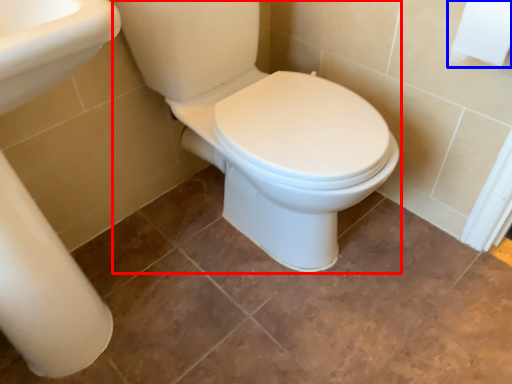
Question: Which object appears closest to the camera in this image, porcelain (highlighted by a red box) or toilet paper (highlighted by a blue box)?

Choices:
 (A) porcelain
 (B) toilet paper

Answer: (A)